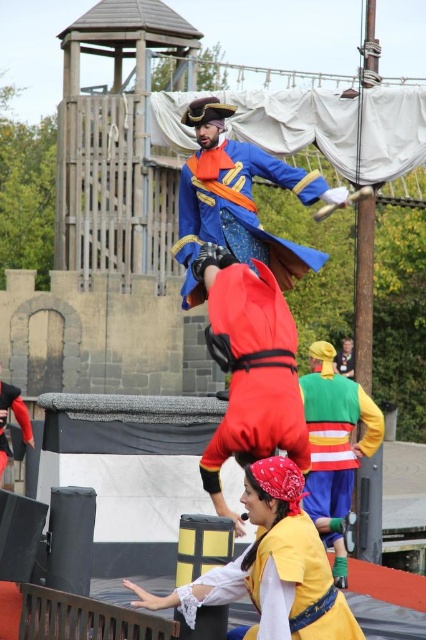
Question: Which object is positioned farthest from the shiny red fabric at center?

Choices:
 (A) blue velvet coat at center
 (B) yellow matte shield at lower center
 (C) multicolored fabric costume at center
 (D) matte black costume at lower left

Answer: (D)

Question: Which object appears farthest from the camera in this image?

Choices:
 (A) shiny red fabric at center
 (B) blue velvet coat at center
 (C) yellow matte shield at lower center
 (D) matte black costume at lower left

Answer: (D)

Question: Does blue velvet coat at center appear on the right side of matte black costume at lower left?

Choices:
 (A) yes
 (B) no

Answer: (A)

Question: Can you confirm if shiny red fabric at center is positioned above yellow matte shield at lower center?

Choices:
 (A) yes
 (B) no

Answer: (A)

Question: Is shiny red fabric at center wider than blue velvet coat at center?

Choices:
 (A) yes
 (B) no

Answer: (B)

Question: Which point is closer to the camera?

Choices:
 (A) (186, 300)
 (B) (0, 413)

Answer: (A)